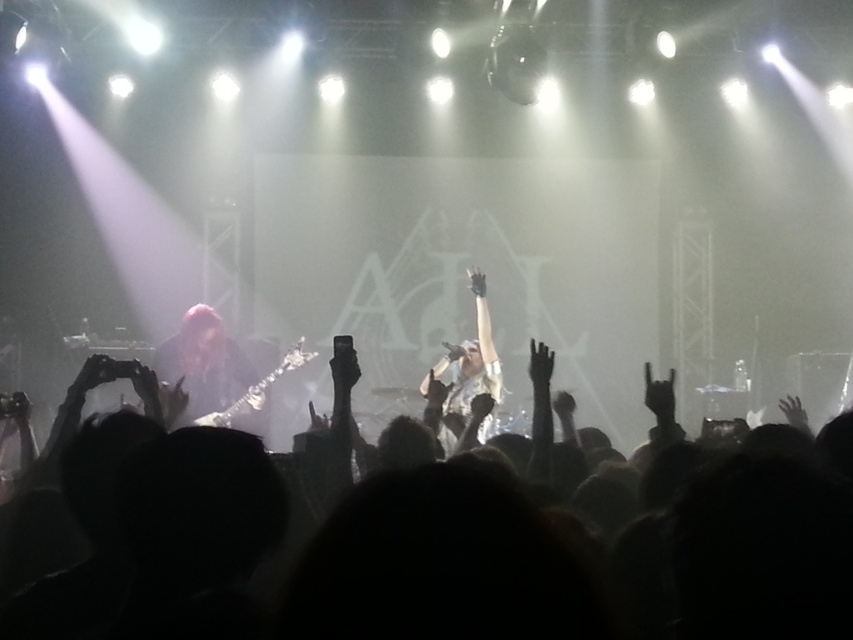
You are a photographer at the concert. You want to capture a photo that includes both the silhouette crowd at center and the shiny red hair at left. Based on their positions, which object should be placed on the right side of the frame to ensure both are visible?

The silhouette crowd at center should be placed on the right side of the frame because it is positioned on the right side of the shiny red hair at left, ensuring both are visible.

You are a photographer at the concert. You want to take a photo of the crowd at the center. The camera has a focus point at coordinate point [438,564]. Will this point be on the crowd?

Yes, the point [438,564] is on the silhouette crowd at center, so the focus point will be on the crowd.